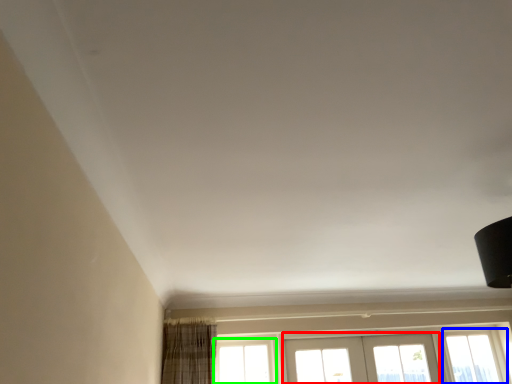
Question: Based on their relative distances, which object is nearer to screen door (highlighted by a red box)? Choose from window (highlighted by a blue box) and window (highlighted by a green box).

Choices:
 (A) window
 (B) window

Answer: (A)